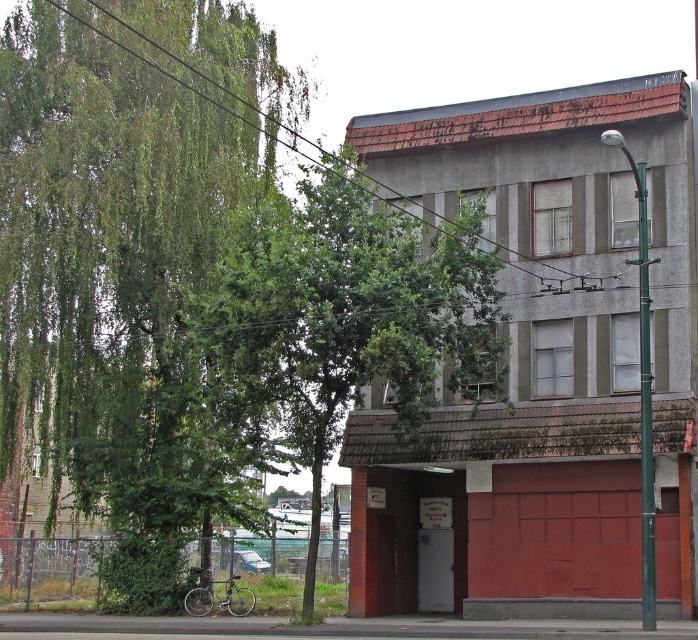
Question: Among these objects, which one is nearest to the camera?

Choices:
 (A) green leafy tree at center
 (B) green metallic pole at right
 (C) green leafy tree at left

Answer: (B)

Question: Does green leafy tree at center come in front of green metallic pole at right?

Choices:
 (A) no
 (B) yes

Answer: (A)

Question: Is green leafy tree at center positioned at the back of green metallic pole at right?

Choices:
 (A) no
 (B) yes

Answer: (B)

Question: Which of the following is the farthest from the observer?

Choices:
 (A) green leafy tree at center
 (B) green metallic pole at right
 (C) green leafy tree at left

Answer: (C)

Question: Can you confirm if green leafy tree at left is thinner than green leafy tree at center?

Choices:
 (A) yes
 (B) no

Answer: (B)

Question: Which point is farther to the camera?

Choices:
 (A) green leafy tree at left
 (B) green leafy tree at center

Answer: (A)